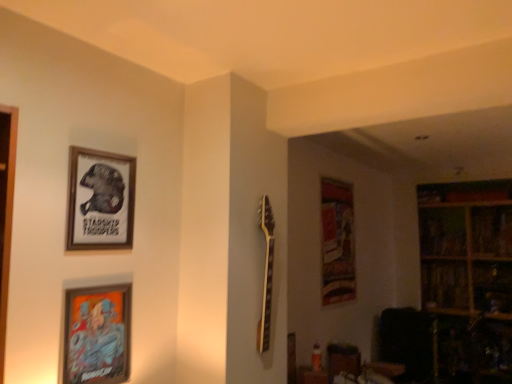
Question: Should I look upward or downward to see wooden bookshelf at upper right, which is the 1th shelf in top-to-bottom order?

Choices:
 (A) up
 (B) down

Answer: (B)

Question: Are wooden bookshelf at right, the second shelf from the top, and wooden bookshelf at upper right, the 2th shelf in the bottom-to-top sequence, located far from each other?

Choices:
 (A) no
 (B) yes

Answer: (A)

Question: From a real-world perspective, is wooden bookshelf at right, the second shelf from the top, positioned under wooden bookshelf at upper right, which is the 1th shelf in top-to-bottom order, based on gravity?

Choices:
 (A) yes
 (B) no

Answer: (A)

Question: Considering the relative sizes of wooden bookshelf at right, the second shelf from the top, and wooden bookshelf at upper right, the 2th shelf in the bottom-to-top sequence, in the image provided, is wooden bookshelf at right, the second shelf from the top, bigger than wooden bookshelf at upper right, the 2th shelf in the bottom-to-top sequence,?

Choices:
 (A) no
 (B) yes

Answer: (A)

Question: Can you confirm if wooden bookshelf at right, the first shelf in the bottom-to-top sequence, is taller than wooden bookshelf at upper right, the 2th shelf in the bottom-to-top sequence?

Choices:
 (A) no
 (B) yes

Answer: (A)

Question: Considering the relative sizes of wooden bookshelf at right, the second shelf from the top, and wooden bookshelf at upper right, which is the 1th shelf in top-to-bottom order, in the image provided, is wooden bookshelf at right, the second shelf from the top, wider than wooden bookshelf at upper right, which is the 1th shelf in top-to-bottom order,?

Choices:
 (A) no
 (B) yes

Answer: (A)

Question: Can you confirm if wooden bookshelf at right, the first shelf in the bottom-to-top sequence, is positioned to the left of wooden bookshelf at upper right, the 2th shelf in the bottom-to-top sequence?

Choices:
 (A) yes
 (B) no

Answer: (B)

Question: Is wooden bookshelf at upper right, the 2th shelf in the bottom-to-top sequence, to the left of wooden bookshelf at right, the second shelf from the top, from the viewer's perspective?

Choices:
 (A) yes
 (B) no

Answer: (A)

Question: Is wooden bookshelf at upper right, the 2th shelf in the bottom-to-top sequence, to the right of wooden bookshelf at right, the second shelf from the top, from the viewer's perspective?

Choices:
 (A) no
 (B) yes

Answer: (A)

Question: Could you tell me if wooden bookshelf at upper right, the 2th shelf in the bottom-to-top sequence, is turned towards wooden bookshelf at right, the second shelf from the top?

Choices:
 (A) yes
 (B) no

Answer: (B)

Question: From the image's perspective, is wooden bookshelf at upper right, which is the 1th shelf in top-to-bottom order, above wooden bookshelf at right, the first shelf in the bottom-to-top sequence?

Choices:
 (A) yes
 (B) no

Answer: (A)

Question: Considering the relative positions of wooden bookshelf at upper right, which is the 1th shelf in top-to-bottom order, and wooden bookshelf at right, the second shelf from the top, in the image provided, is wooden bookshelf at upper right, which is the 1th shelf in top-to-bottom order, behind wooden bookshelf at right, the second shelf from the top,?

Choices:
 (A) no
 (B) yes

Answer: (B)

Question: Can you confirm if wooden framed poster at upper left, which ranks as the first picture frame in top-to-bottom order, is bigger than wooden bookshelf at upper right, the 2th shelf in the bottom-to-top sequence?

Choices:
 (A) yes
 (B) no

Answer: (B)